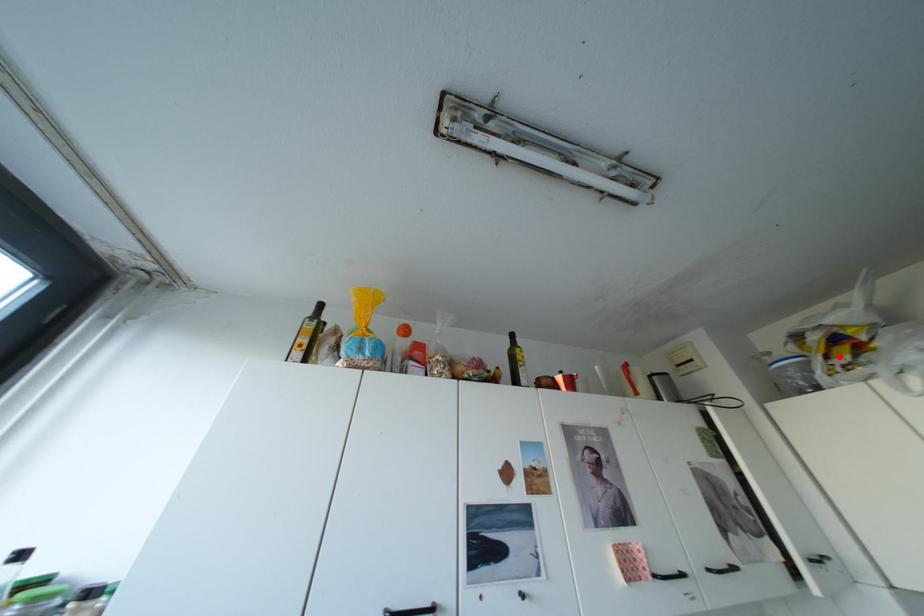
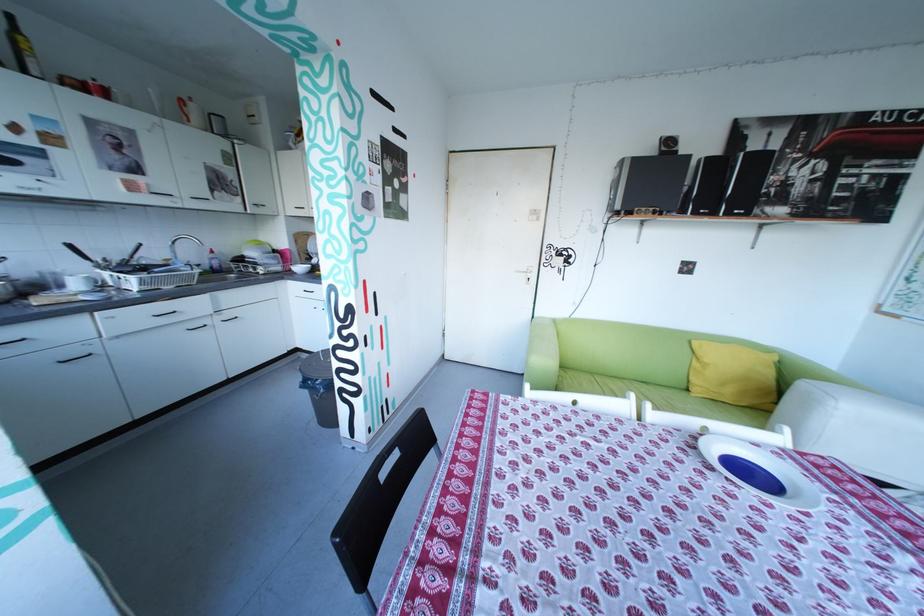
Question: I am providing you with two images of the same scene from different viewpoints. A red point is marked on the first image. Is the red point's position out of view in image 2?

Choices:
 (A) Yes
 (B) No

Answer: (A)